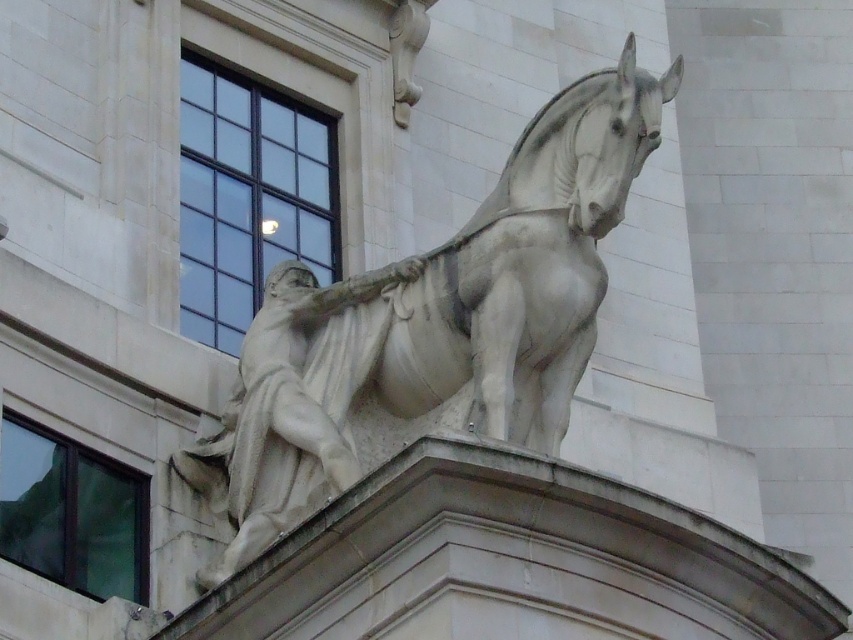
Can you confirm if white marble horse at upper center is positioned above white marble statue at upper center?

Yes, white marble horse at upper center is above white marble statue at upper center.

Identify the location of white marble horse at upper center. (434, 324).

The width and height of the screenshot is (853, 640). What do you see at coordinates (434, 324) in the screenshot?
I see `white marble horse at upper center` at bounding box center [434, 324].

Locate an element on the screen. white marble horse at upper center is located at coordinates (434, 324).